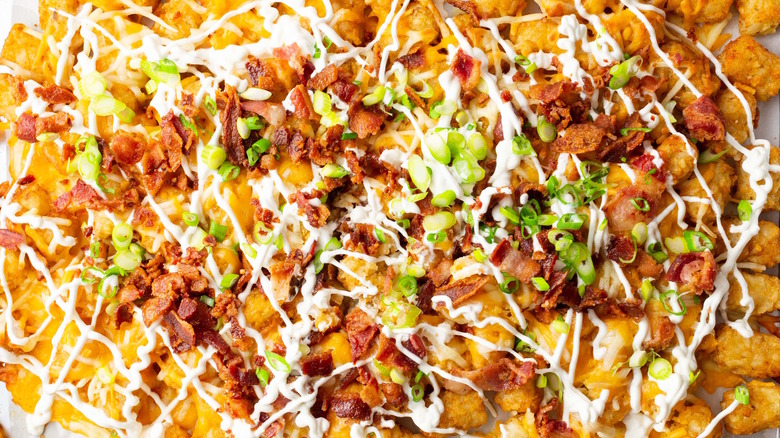
Locate an element on the screen. plate is located at coordinates (766, 117).